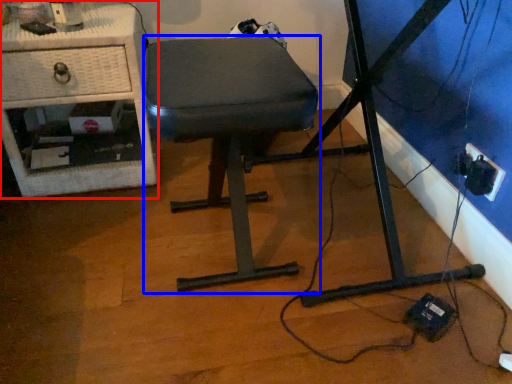
Question: Among these objects, which one is nearest to the camera, furniture (highlighted by a red box) or stool (highlighted by a blue box)?

Choices:
 (A) furniture
 (B) stool

Answer: (B)